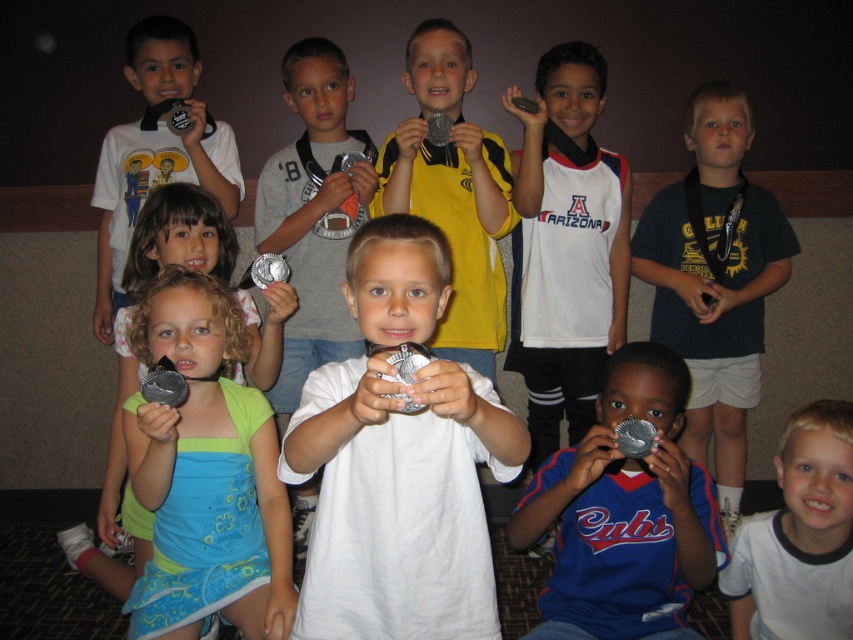
You are a photographer adjusting your camera to focus on the medals. Which medal should you focus on first if you want to capture both the white matte medal at center and the metallic silver medal at center in sharp detail?

The white matte medal at center is closer to the viewer than the metallic silver medal at center, so you should focus on the white matte medal at center first to ensure both are in sharp detail.

You are a photographer taking a photo of two medals. You see a white matte medal at center and a metallic silver medal at center. Which medal is located to the left?

The white matte medal at center is positioned to the left of the metallic silver medal at center.

You are standing in the gymnasium where the children are posing for a photo. You notice two points marked on the floor at coordinates point (750, 230) and point (457, 284). If you were to walk from the first point to the second, would you be moving closer to or farther from the camera?

Moving closer to the camera because point (750, 230) is further away from the camera than point (457, 284), so walking from the first point to the second would bring you closer to the camera.